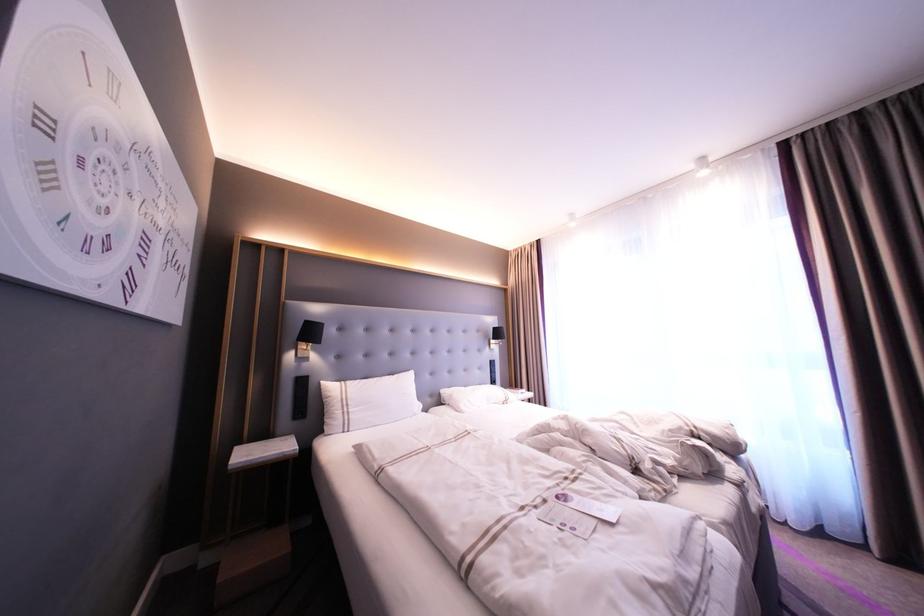
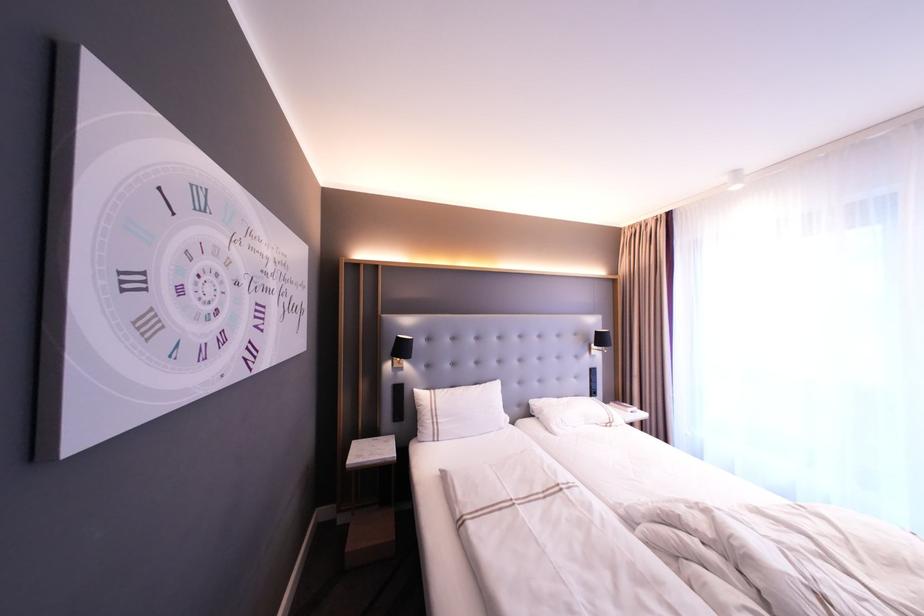
Find the pixel in the second image that matches pixel 311 331 in the first image.

(402, 349)